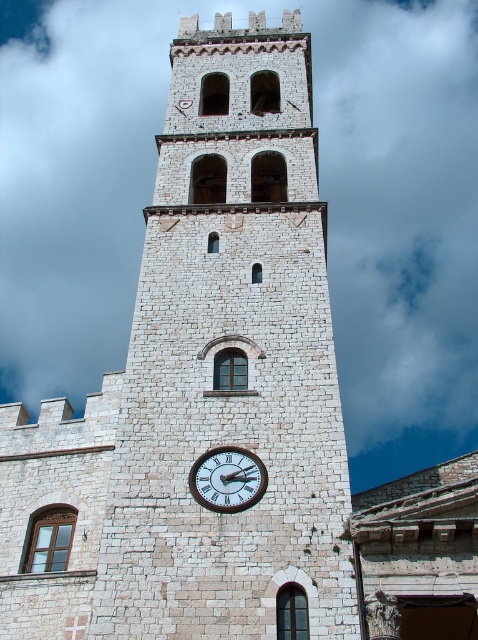
Is white stone clock tower at center taller than white wooden clock at center?

Indeed, white stone clock tower at center has a greater height compared to white wooden clock at center.

Does white stone clock tower at center appear under white wooden clock at center?

No.

Is point (245, 349) in front of point (217, 451)?

No, (245, 349) is further to viewer.

The width and height of the screenshot is (478, 640). Find the location of `white stone clock tower at center`. white stone clock tower at center is located at coordinates (230, 362).